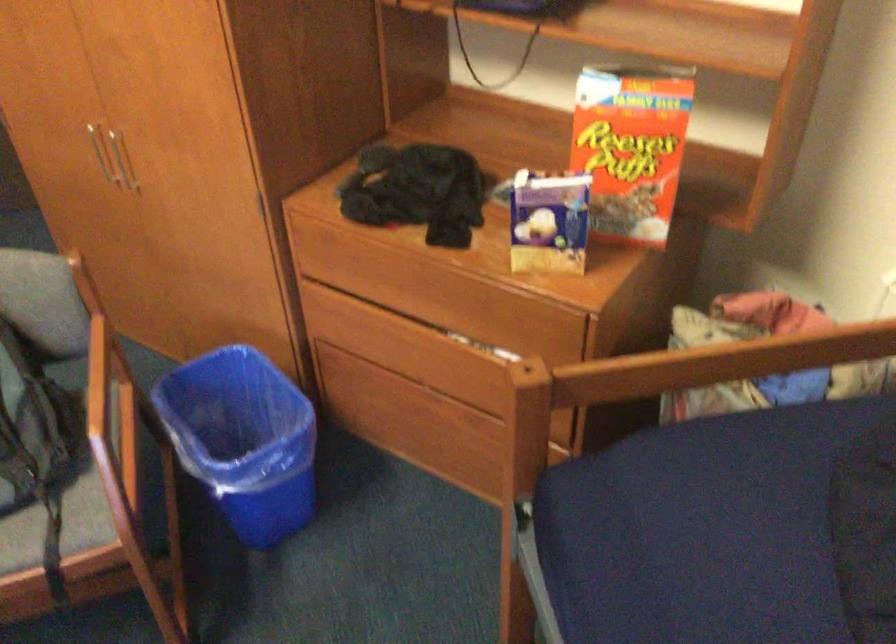
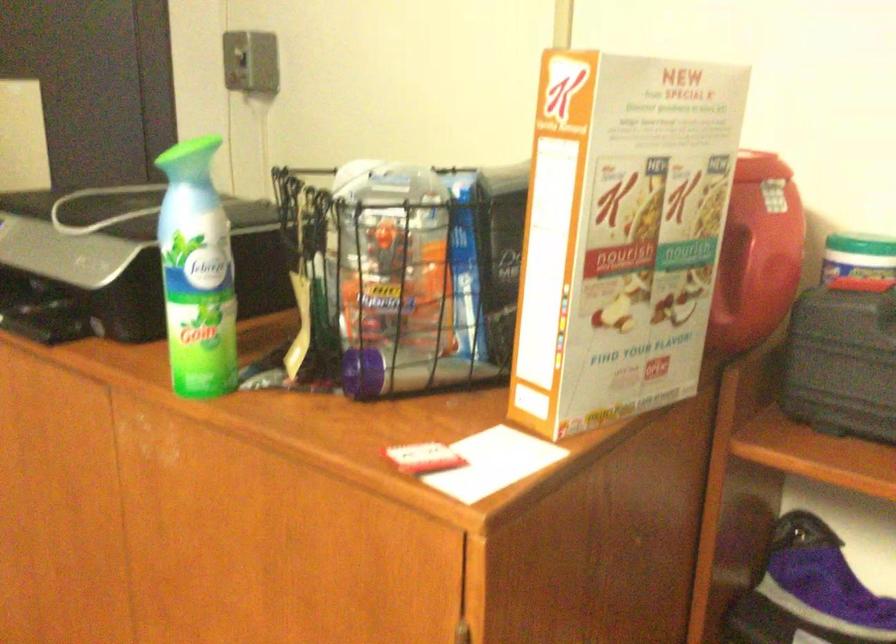
In a continuous first-person perspective shot, in which direction is the camera moving?

The movement direction of the cameraman is left, forward.